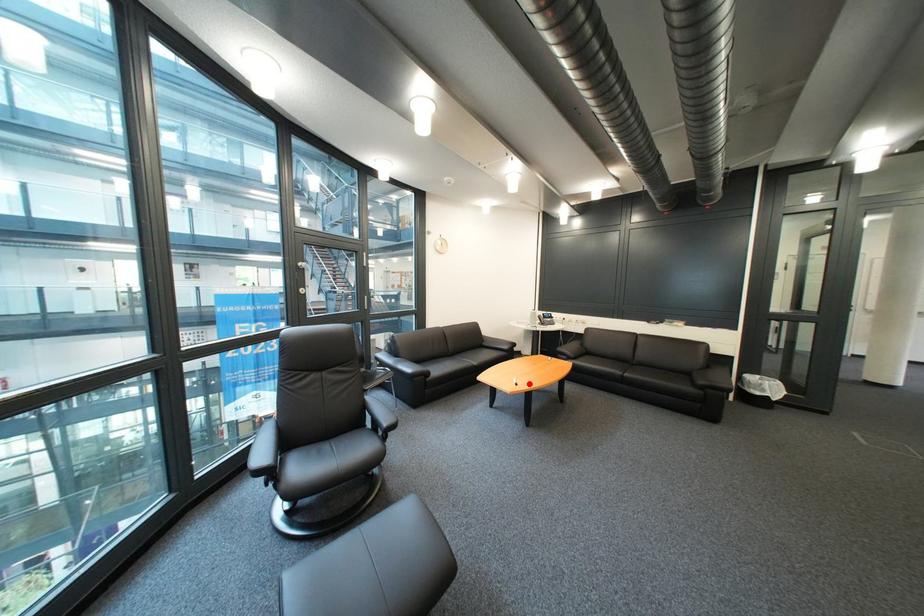
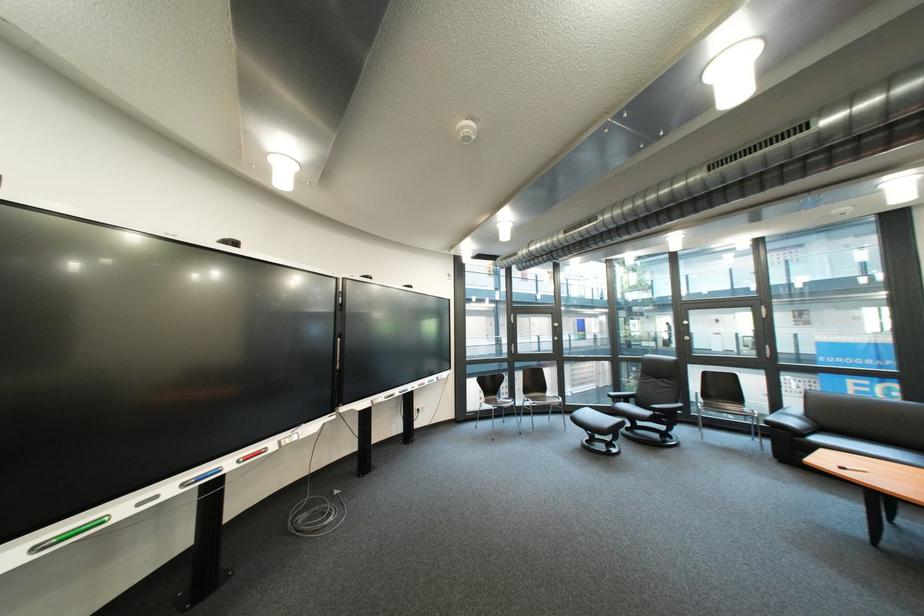
Question: I am providing you with two images of the same scene from different viewpoints. A red point is marked on the first image. Is the red point's position out of view in image 2?

Choices:
 (A) Yes
 (B) No

Answer: (B)